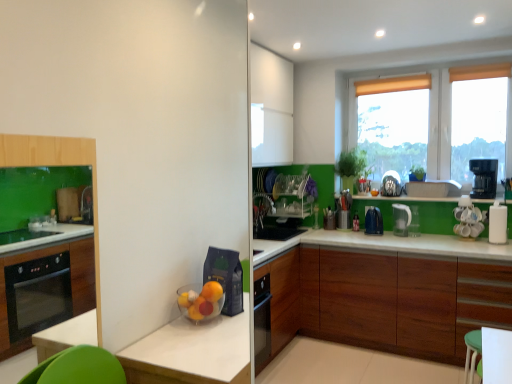
I want to click on vacant point above wooden cabinet at lower right (from a real-world perspective), so tap(420, 241).